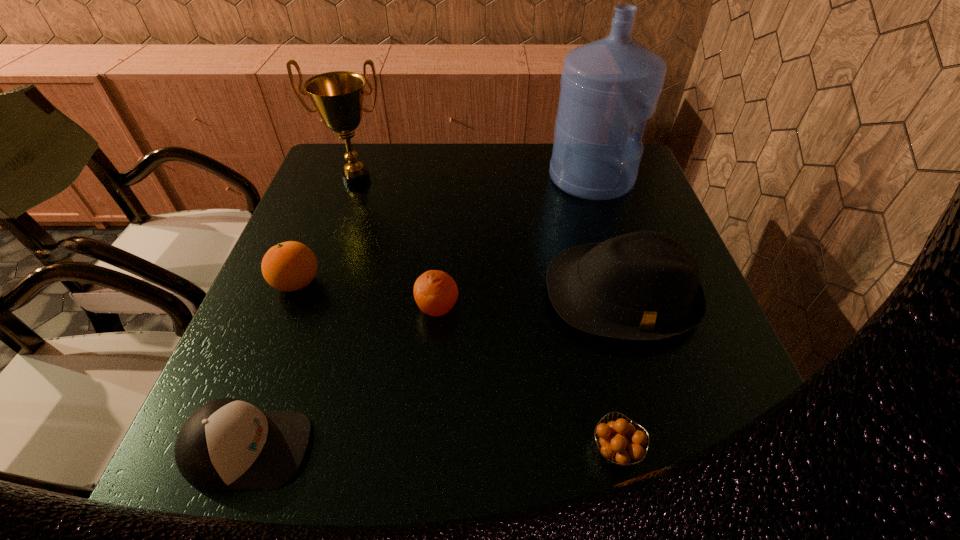
Identify the location of vacant region located 0.310m on the back of the leftmost orange fruit. (335, 186).

Identify the location of free space located 0.240m on the front of the fourth object from right to left. (426, 444).

The height and width of the screenshot is (540, 960). What are the coordinates of `vacant space located 0.060m on the front panel of the cap` in the screenshot? It's located at (348, 448).

Where is `vacant region located 0.060m on the back of the rightmost orange fruit`? The image size is (960, 540). vacant region located 0.060m on the back of the rightmost orange fruit is located at coordinates (603, 393).

At what (x,y) coordinates should I click in order to perform the action: click on water jug present at the far edge. Please return your answer as a coordinate pair (x, y). Looking at the image, I should click on (607, 86).

Where is `award that is at the far edge`? This screenshot has height=540, width=960. award that is at the far edge is located at coordinates (338, 96).

Where is `cap that is at the near edge`? The width and height of the screenshot is (960, 540). cap that is at the near edge is located at coordinates (227, 444).

This screenshot has width=960, height=540. I want to click on orange fruit positioned at the near edge, so click(x=618, y=448).

Image resolution: width=960 pixels, height=540 pixels. What are the coordinates of `award that is at the left edge` in the screenshot? It's located at (338, 96).

At what (x,y) coordinates should I click in order to perform the action: click on orange present at the left edge. Please return your answer as a coordinate pair (x, y). Image resolution: width=960 pixels, height=540 pixels. Looking at the image, I should click on (289, 266).